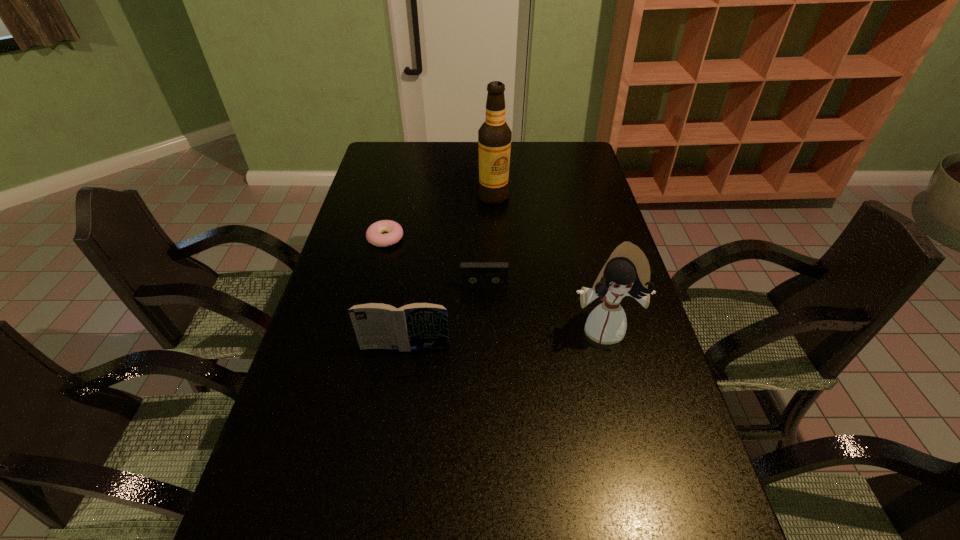
In the image, there is a desktop. At what (x,y) coordinates should I click in order to perform the action: click on vacant space at the far left corner. Please return your answer as a coordinate pair (x, y). Image resolution: width=960 pixels, height=540 pixels. Looking at the image, I should click on (390, 165).

In the image, there is a desktop. At what (x,y) coordinates should I click in order to perform the action: click on vacant space at the far right corner. Please return your answer as a coordinate pair (x, y). Looking at the image, I should click on (587, 153).

Image resolution: width=960 pixels, height=540 pixels. In order to click on vacant area that lies between the second farthest object and the third farthest object in this screenshot , I will do `click(435, 262)`.

The width and height of the screenshot is (960, 540). In order to click on vacant space in between the fourth tallest object and the doll in this screenshot , I will do `click(543, 307)`.

Identify the location of free area in between the rightmost object and the videotape. This screenshot has height=540, width=960. (543, 307).

Where is `unoccupied position between the second shortest object and the alcohol`? unoccupied position between the second shortest object and the alcohol is located at coordinates (489, 241).

Where is `vacant space in between the third farthest object and the alcohol`? This screenshot has height=540, width=960. vacant space in between the third farthest object and the alcohol is located at coordinates (489, 241).

Locate an element on the screen. This screenshot has height=540, width=960. free spot between the second shortest object and the fourth shortest object is located at coordinates (543, 307).

This screenshot has width=960, height=540. I want to click on free space between the alcohol and the book, so click(x=449, y=272).

This screenshot has width=960, height=540. Find the location of `free space between the tallest object and the second tallest object`. free space between the tallest object and the second tallest object is located at coordinates (548, 263).